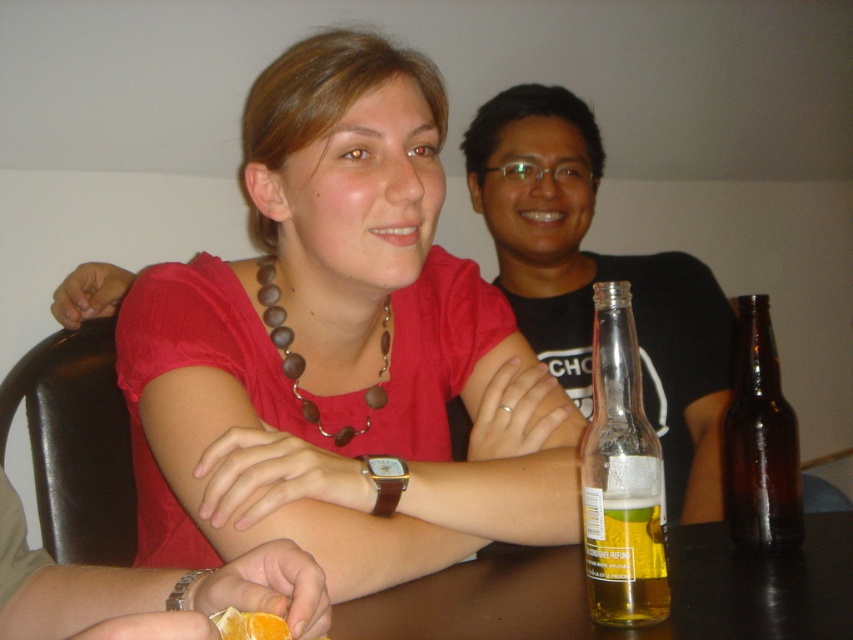
Does matte red shirt at center appear on the right side of brown wooden beads at center?

Correct, you'll find matte red shirt at center to the right of brown wooden beads at center.

Can you confirm if matte red shirt at center is bigger than brown wooden beads at center?

Correct, matte red shirt at center is larger in size than brown wooden beads at center.

Locate an element on the screen. The image size is (853, 640). matte red shirt at center is located at coordinates (331, 346).

Locate an element on the screen. This screenshot has width=853, height=640. matte red shirt at center is located at coordinates (331, 346).

Does point (316, 253) lie in front of point (258, 634)?

No, it is behind (258, 634).

The width and height of the screenshot is (853, 640). I want to click on matte red shirt at center, so click(331, 346).

In the scene shown: Does matte red shirt at center appear on the right side of brown wooden table at lower center?

In fact, matte red shirt at center is to the left of brown wooden table at lower center.

Can you confirm if matte red shirt at center is thinner than brown wooden table at lower center?

No, matte red shirt at center is not thinner than brown wooden table at lower center.

Who is more forward, (283, 216) or (436, 637)?

Point (436, 637)

Where is `matte red shirt at center`? matte red shirt at center is located at coordinates (331, 346).